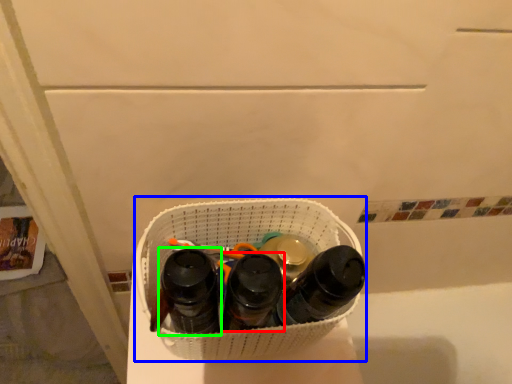
Question: Considering the real-world distances, which object is closest to footwear (highlighted by a red box)? laundry basket (highlighted by a blue box) or footwear (highlighted by a green box).

Choices:
 (A) laundry basket
 (B) footwear

Answer: (B)